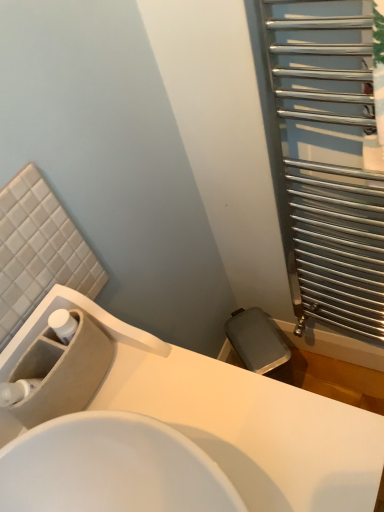
Question: Are white glossy sink at center, the 1th sink in the front-to-back sequence, and silver metallic radiator at right beside each other?

Choices:
 (A) yes
 (B) no

Answer: (B)

Question: Are white glossy sink at center, which is the second sink from back to front, and silver metallic radiator at right far apart?

Choices:
 (A) yes
 (B) no

Answer: (B)

Question: From a real-world perspective, is white glossy sink at center, the 1th sink in the front-to-back sequence, on silver metallic radiator at right?

Choices:
 (A) no
 (B) yes

Answer: (A)

Question: Is white glossy sink at center, the 1th sink in the front-to-back sequence, smaller than silver metallic radiator at right?

Choices:
 (A) no
 (B) yes

Answer: (A)

Question: Does white glossy sink at center, the 1th sink in the front-to-back sequence, have a larger size compared to silver metallic radiator at right?

Choices:
 (A) no
 (B) yes

Answer: (B)

Question: Is silver metallic radiator at right bigger or smaller than white glossy sink at center, which is the second sink from back to front?

Choices:
 (A) small
 (B) big

Answer: (A)

Question: In the image, is silver metallic radiator at right on the left side or the right side of white glossy sink at center, the 1th sink in the front-to-back sequence?

Choices:
 (A) right
 (B) left

Answer: (A)

Question: Is point (372, 218) positioned closer to the camera than point (264, 501)?

Choices:
 (A) farther
 (B) closer

Answer: (A)

Question: From a real-world perspective, relative to white glossy sink at center, the 1th sink in the front-to-back sequence, is silver metallic radiator at right vertically above or below?

Choices:
 (A) above
 (B) below

Answer: (A)

Question: From their relative heights in the image, would you say beige matte sink at lower left, which is the 2th sink in front-to-back order, is taller or shorter than silver metallic radiator at right?

Choices:
 (A) short
 (B) tall

Answer: (A)

Question: Is beige matte sink at lower left, placed as the first sink when sorted from back to front, wider or thinner than silver metallic radiator at right?

Choices:
 (A) thin
 (B) wide

Answer: (B)

Question: From a real-world perspective, is beige matte sink at lower left, placed as the first sink when sorted from back to front, above or below silver metallic radiator at right?

Choices:
 (A) above
 (B) below

Answer: (A)

Question: Is beige matte sink at lower left, which is the 2th sink in front-to-back order, bigger or smaller than silver metallic radiator at right?

Choices:
 (A) big
 (B) small

Answer: (B)

Question: Relative to white glossy sink at center, the 1th sink in the front-to-back sequence, is beige matte sink at lower left, placed as the first sink when sorted from back to front, in front or behind?

Choices:
 (A) front
 (B) behind

Answer: (B)

Question: In terms of size, does beige matte sink at lower left, placed as the first sink when sorted from back to front, appear bigger or smaller than white glossy sink at center, the 1th sink in the front-to-back sequence?

Choices:
 (A) small
 (B) big

Answer: (A)